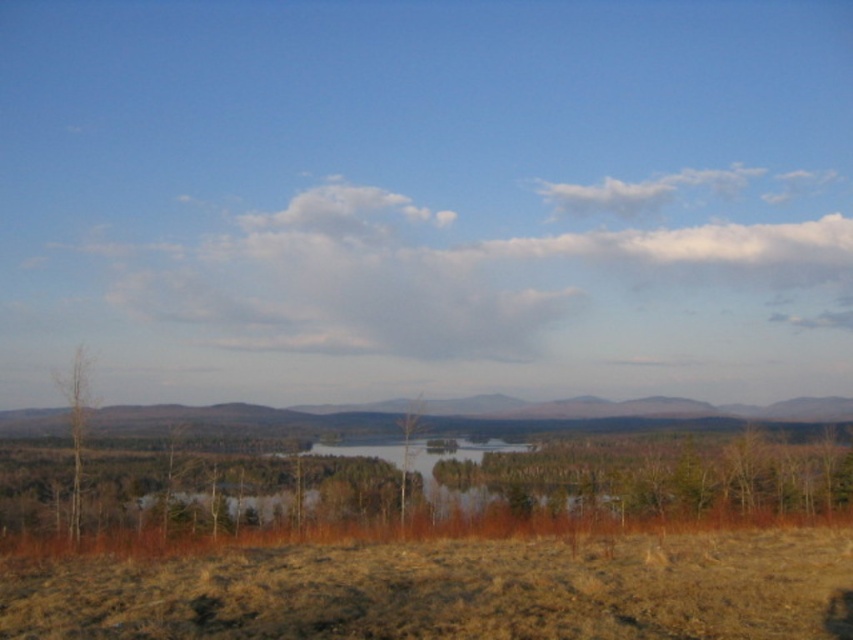
Question: Can you confirm if white fluffy cloud at upper center is positioned below brown textured mountain at center?

Choices:
 (A) no
 (B) yes

Answer: (A)

Question: Which object appears closest to the camera in this image?

Choices:
 (A) brown grassland at lower center
 (B) clear water at center

Answer: (A)

Question: Does brown grassland at lower center appear over brown rough tree at center?

Choices:
 (A) no
 (B) yes

Answer: (B)

Question: Which point appears farthest from the camera in this image?

Choices:
 (A) (405, 474)
 (B) (402, 275)
 (C) (814, 554)

Answer: (B)

Question: Does white fluffy cloud at upper center appear on the left side of brown grassland at lower center?

Choices:
 (A) yes
 (B) no

Answer: (B)

Question: Which object is closer to the camera taking this photo?

Choices:
 (A) brown textured mountain at center
 (B) bare wood tree at left
 (C) white fluffy cloud at upper center
 (D) brown rough tree at center

Answer: (B)